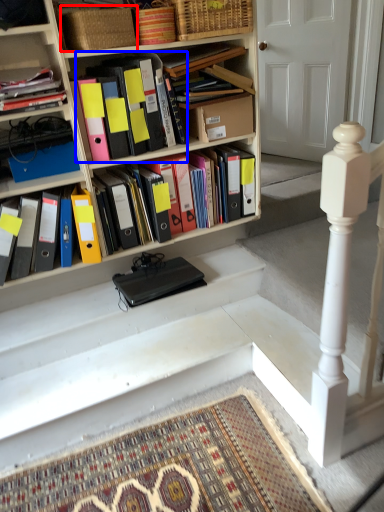
Question: Among these objects, which one is farthest to the camera, basket (highlighted by a red box) or book (highlighted by a blue box)?

Choices:
 (A) basket
 (B) book

Answer: (B)